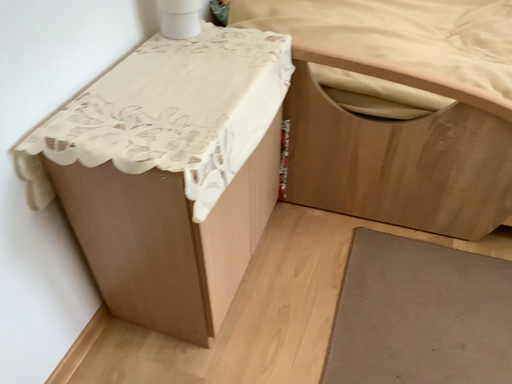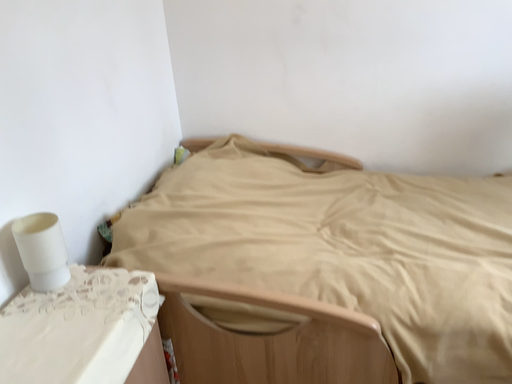
Question: Which way did the camera rotate in the video?

Choices:
 (A) rotated upward
 (B) rotated downward

Answer: (A)